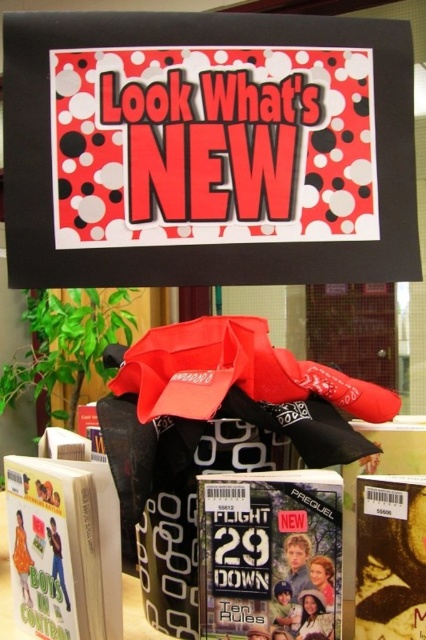
Between matte paper magazine at center and matte cardboard magazine at lower left, which one appears on the right side from the viewer's perspective?

From the viewer's perspective, matte paper magazine at center appears more on the right side.

Which of these two, matte paper magazine at center or matte cardboard magazine at lower left, stands taller?

matte cardboard magazine at lower left

Is point (264, 588) positioned after point (101, 532)?

No, (264, 588) is closer to viewer.

You are a GUI agent. You are given a task and a screenshot of the screen. Output one action in this format:
    pyautogui.click(x=<x>, y=<y>)
    Task: Click on the matte paper magazine at center
    This screenshot has width=426, height=640.
    Given the screenshot: What is the action you would take?
    pyautogui.click(x=270, y=556)

What do you see at coordinates (270, 556) in the screenshot? This screenshot has height=640, width=426. I see `matte paper magazine at center` at bounding box center [270, 556].

The height and width of the screenshot is (640, 426). I want to click on matte paper magazine at center, so click(270, 556).

Where is `matte paper magazine at center`? matte paper magazine at center is located at coordinates (270, 556).

Is matte cardboard magazine at lower left below matte brown magazine at lower right?

Yes, matte cardboard magazine at lower left is below matte brown magazine at lower right.

Who is more forward, [97,532] or [359,593]?

Point [359,593] is in front.

At what (x,y) coordinates should I click in order to perform the action: click on matte cardboard magazine at lower left. Please return your answer as a coordinate pair (x, y). This screenshot has width=426, height=640. Looking at the image, I should click on (63, 547).